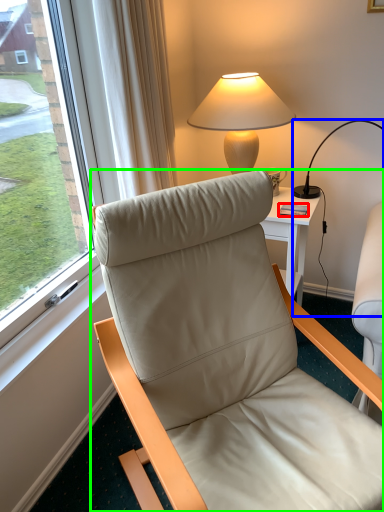
Question: Which object is the closest to the mobile phone (highlighted by a red box)? Choose among these: lamp (highlighted by a blue box) or chair (highlighted by a green box).

Choices:
 (A) lamp
 (B) chair

Answer: (A)